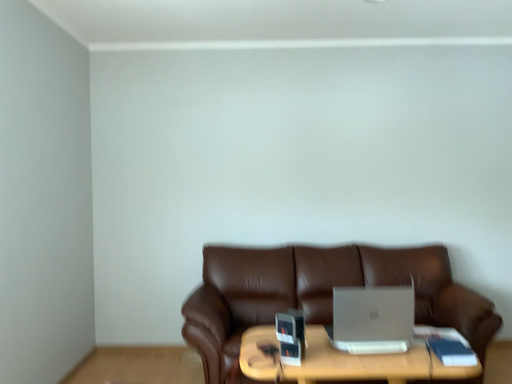
Question: From the image's perspective, is silver metallic laptop at center beneath brown leather couch at center?

Choices:
 (A) no
 (B) yes

Answer: (A)

Question: Does silver metallic laptop at center appear on the left side of brown leather couch at center?

Choices:
 (A) yes
 (B) no

Answer: (A)

Question: Is silver metallic laptop at center facing away from brown leather couch at center?

Choices:
 (A) no
 (B) yes

Answer: (B)

Question: From a real-world perspective, is silver metallic laptop at center located beneath brown leather couch at center?

Choices:
 (A) no
 (B) yes

Answer: (A)

Question: Is silver metallic laptop at center to the right of brown leather couch at center from the viewer's perspective?

Choices:
 (A) no
 (B) yes

Answer: (A)

Question: Is silver metallic laptop at center bigger or smaller than wooden table at center?

Choices:
 (A) big
 (B) small

Answer: (B)

Question: Relative to wooden table at center, is silver metallic laptop at center in front or behind?

Choices:
 (A) front
 (B) behind

Answer: (B)

Question: From the image's perspective, is silver metallic laptop at center above or below wooden table at center?

Choices:
 (A) below
 (B) above

Answer: (B)

Question: Considering the positions of point (366, 326) and point (408, 360), is point (366, 326) closer or farther from the camera than point (408, 360)?

Choices:
 (A) closer
 (B) farther

Answer: (B)

Question: Does point (313, 377) appear closer or farther from the camera than point (344, 344)?

Choices:
 (A) closer
 (B) farther

Answer: (A)

Question: Considering the positions of wooden table at center and silver metallic laptop at center in the image, is wooden table at center taller or shorter than silver metallic laptop at center?

Choices:
 (A) short
 (B) tall

Answer: (B)

Question: Visually, is wooden table at center positioned to the left or to the right of silver metallic laptop at center?

Choices:
 (A) right
 (B) left

Answer: (B)

Question: Considering their positions, is wooden table at center located in front of or behind silver metallic laptop at center?

Choices:
 (A) behind
 (B) front

Answer: (B)

Question: Visually, is wooden table at center positioned to the left or to the right of brown leather couch at center?

Choices:
 (A) left
 (B) right

Answer: (A)

Question: Is wooden table at center taller or shorter than brown leather couch at center?

Choices:
 (A) tall
 (B) short

Answer: (B)